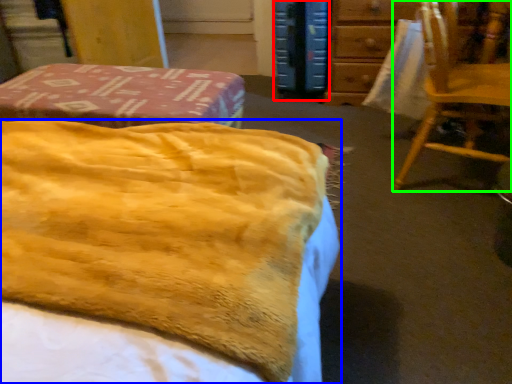
Question: Based on their relative distances, which object is farther from paperback book (highlighted by a red box)? Choose from bed (highlighted by a blue box) and chair (highlighted by a green box).

Choices:
 (A) bed
 (B) chair

Answer: (A)